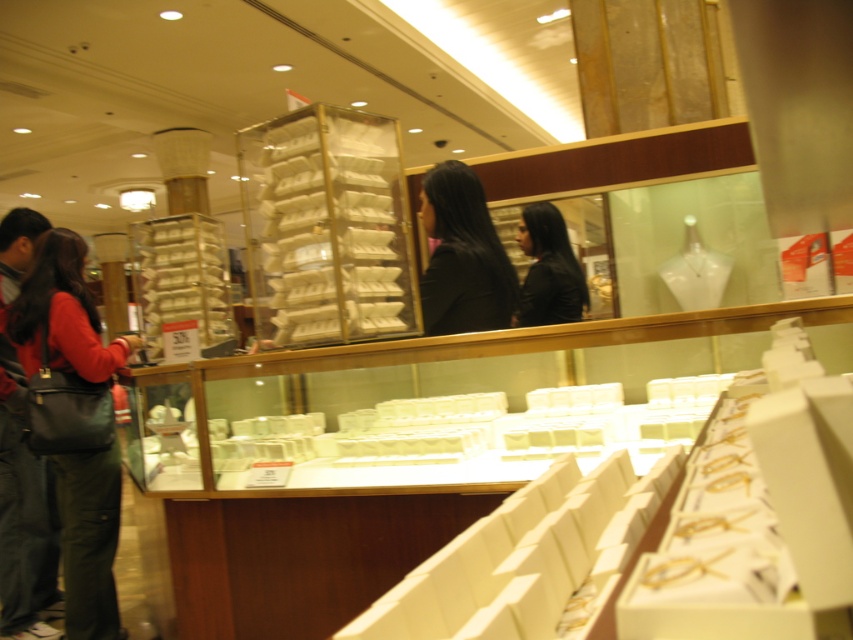
Question: Which of the following is the closest to the observer?

Choices:
 (A) black matte hair at center
 (B) matte black handbag at left

Answer: (B)

Question: Which point appears farthest from the camera in this image?

Choices:
 (A) (456, 168)
 (B) (529, 323)

Answer: (B)

Question: Can you confirm if matte black handbag at left is smaller than black matte hair at center?

Choices:
 (A) no
 (B) yes

Answer: (A)

Question: Is matte black handbag at left above black matte hair at center?

Choices:
 (A) no
 (B) yes

Answer: (A)

Question: Considering the real-world distances, which object is closest to the matte black handbag at left?

Choices:
 (A) black matte hair at center
 (B) black matte jacket at center

Answer: (A)

Question: Can you confirm if matte black handbag at left is thinner than black matte jacket at center?

Choices:
 (A) no
 (B) yes

Answer: (A)